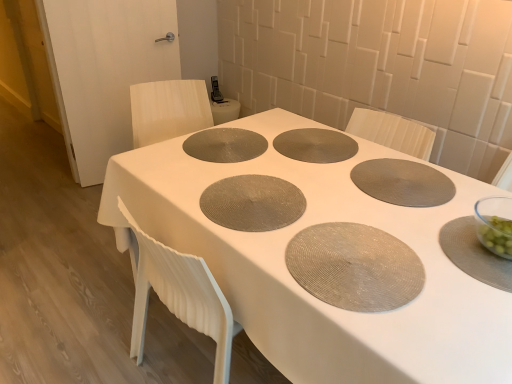
Locate an element on the screen. The height and width of the screenshot is (384, 512). free location in front of matte gray placemat at center right, which ranks as the third pizza pan in left-to-right order is located at coordinates (404, 224).